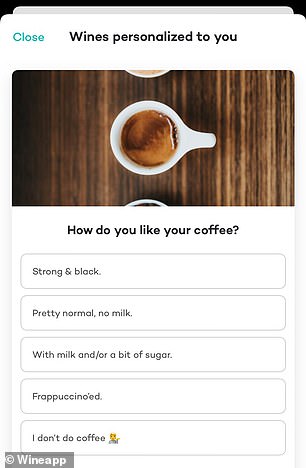
This screenshot has height=468, width=306. What are the coordinates of `cups` in the screenshot? It's located at (152, 81), (207, 132), (162, 198).